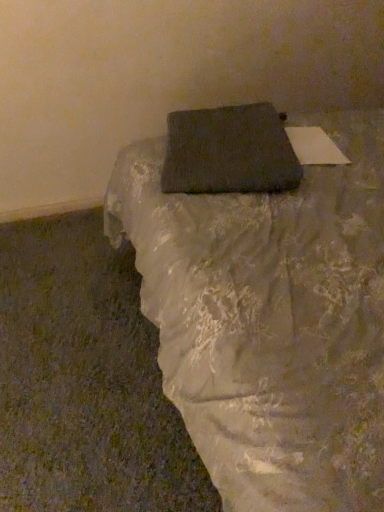
This screenshot has height=512, width=384. What do you see at coordinates (270, 320) in the screenshot? I see `matte black book at upper center` at bounding box center [270, 320].

Identify the location of matte black book at upper center. (270, 320).

The image size is (384, 512). What do you see at coordinates (229, 151) in the screenshot?
I see `dark gray fabric pillow at center` at bounding box center [229, 151].

Find the location of a particular element. Image resolution: width=384 pixels, height=512 pixels. dark gray fabric pillow at center is located at coordinates (229, 151).

Locate an element on the screen. matte black book at upper center is located at coordinates pyautogui.click(x=270, y=320).

Can you confirm if dark gray fabric pillow at center is positioned to the right of matte black book at upper center?

No, dark gray fabric pillow at center is not to the right of matte black book at upper center.

Is dark gray fabric pillow at center positioned behind matte black book at upper center?

Yes, it is behind matte black book at upper center.

Does point (296, 166) come in front of point (209, 396)?

No, it is not.

From the image's perspective, is dark gray fabric pillow at center over matte black book at upper center?

Yes, from the image's perspective, dark gray fabric pillow at center is on top of matte black book at upper center.

From a real-world perspective, who is located lower, dark gray fabric pillow at center or matte black book at upper center?

From a 3D spatial view, matte black book at upper center is below.

Looking at this image, does dark gray fabric pillow at center have a lesser width compared to matte black book at upper center?

Yes, dark gray fabric pillow at center is thinner than matte black book at upper center.

Does dark gray fabric pillow at center have a lesser height compared to matte black book at upper center?

Yes.

Is dark gray fabric pillow at center bigger or smaller than matte black book at upper center?

In the image, dark gray fabric pillow at center appears to be smaller than matte black book at upper center.

Is dark gray fabric pillow at center positioned beyond the bounds of matte black book at upper center?

No, most part of dark gray fabric pillow at center lies within matte black book at upper center.

Is dark gray fabric pillow at center placed right next to matte black book at upper center?

There is a gap between dark gray fabric pillow at center and matte black book at upper center.

From the picture: Is dark gray fabric pillow at center turned away from matte black book at upper center?

Yes, dark gray fabric pillow at center is facing away from matte black book at upper center.

How much distance is there between dark gray fabric pillow at center and matte black book at upper center?

10.11 inches.

The height and width of the screenshot is (512, 384). Find the location of `pillow above the matte black book at upper center (from the image's perspective)`. pillow above the matte black book at upper center (from the image's perspective) is located at coordinates (229, 151).

In the scene shown: Considering the relative positions of matte black book at upper center and dark gray fabric pillow at center in the image provided, is matte black book at upper center to the left of dark gray fabric pillow at center from the viewer's perspective?

In fact, matte black book at upper center is to the right of dark gray fabric pillow at center.

Who is more distant, matte black book at upper center or dark gray fabric pillow at center?

Positioned behind is dark gray fabric pillow at center.

Which is nearer, (321,296) or (288,174)?

Point (321,296) is positioned closer to the camera compared to point (288,174).

From the image's perspective, which object appears higher, matte black book at upper center or dark gray fabric pillow at center?

From the image's view, dark gray fabric pillow at center is above.

From a real-world perspective, which is physically above, matte black book at upper center or dark gray fabric pillow at center?

dark gray fabric pillow at center is physically above.

Between matte black book at upper center and dark gray fabric pillow at center, which one has smaller width?

Thinner between the two is dark gray fabric pillow at center.

Considering the sizes of objects matte black book at upper center and dark gray fabric pillow at center in the image provided, who is taller, matte black book at upper center or dark gray fabric pillow at center?

matte black book at upper center is taller.

Considering the sizes of objects matte black book at upper center and dark gray fabric pillow at center in the image provided, who is smaller, matte black book at upper center or dark gray fabric pillow at center?

dark gray fabric pillow at center is smaller.

Can dark gray fabric pillow at center be found inside matte black book at upper center?

Indeed, dark gray fabric pillow at center is located within matte black book at upper center.

Is matte black book at upper center not near dark gray fabric pillow at center?

No, matte black book at upper center is not far away from dark gray fabric pillow at center.

Is matte black book at upper center aimed at dark gray fabric pillow at center?

Yes, matte black book at upper center is turned towards dark gray fabric pillow at center.

How different are the orientations of matte black book at upper center and dark gray fabric pillow at center in degrees?

There is a 17.1-degree angle between the facing directions of matte black book at upper center and dark gray fabric pillow at center.

Identify the location of furniture directly beneath the dark gray fabric pillow at center (from a real-world perspective). (270, 320).

Where is `furniture that appears in front of the dark gray fabric pillow at center`? furniture that appears in front of the dark gray fabric pillow at center is located at coordinates (270, 320).

In order to click on furniture below the dark gray fabric pillow at center (from a real-world perspective) in this screenshot , I will do `click(270, 320)`.